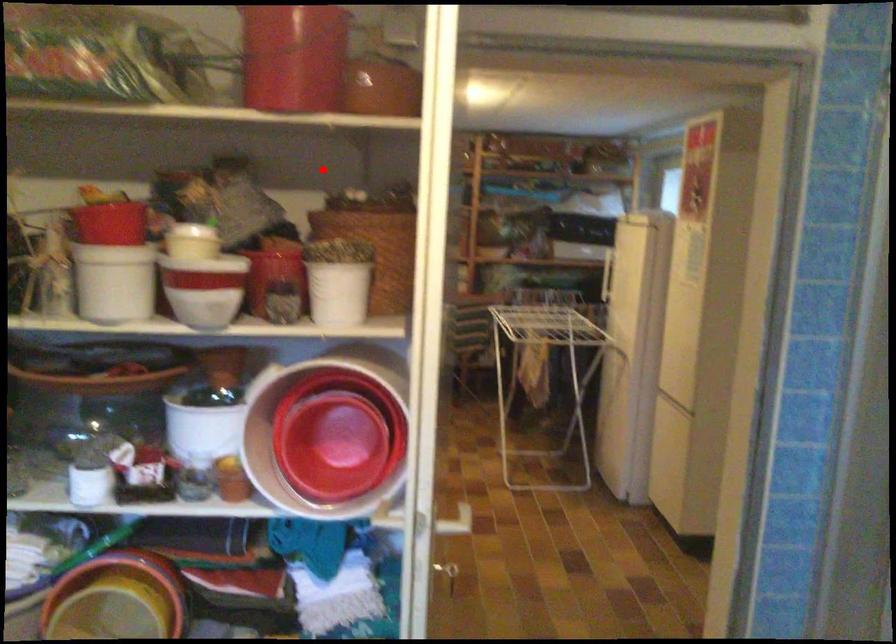
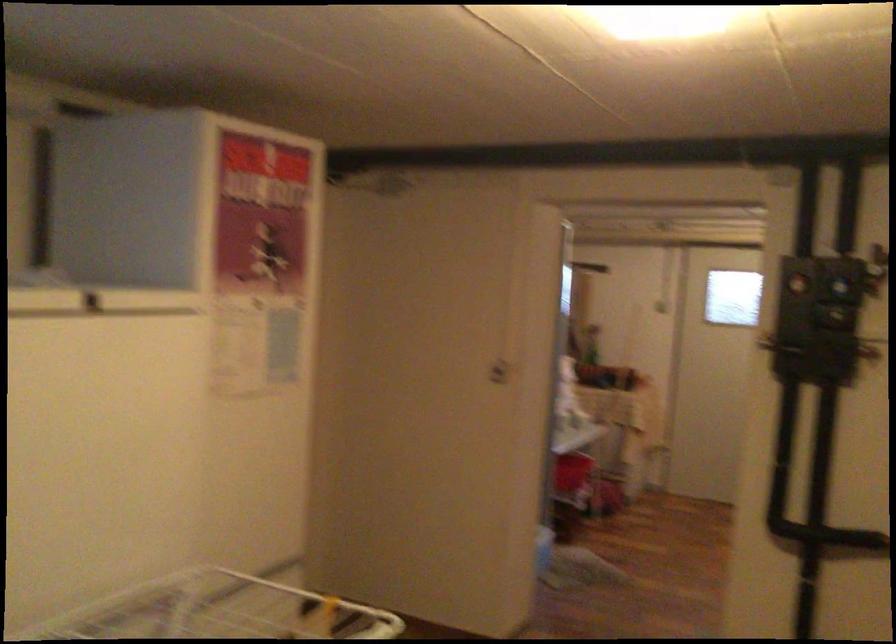
Question: A red point is marked in image1. In image2, is the corresponding 3D point closer to the camera or farther? Reply with the corresponding letter.

Choices:
 (A) The corresponding 3D point is closer.
 (B) The corresponding 3D point is farther.

Answer: (B)